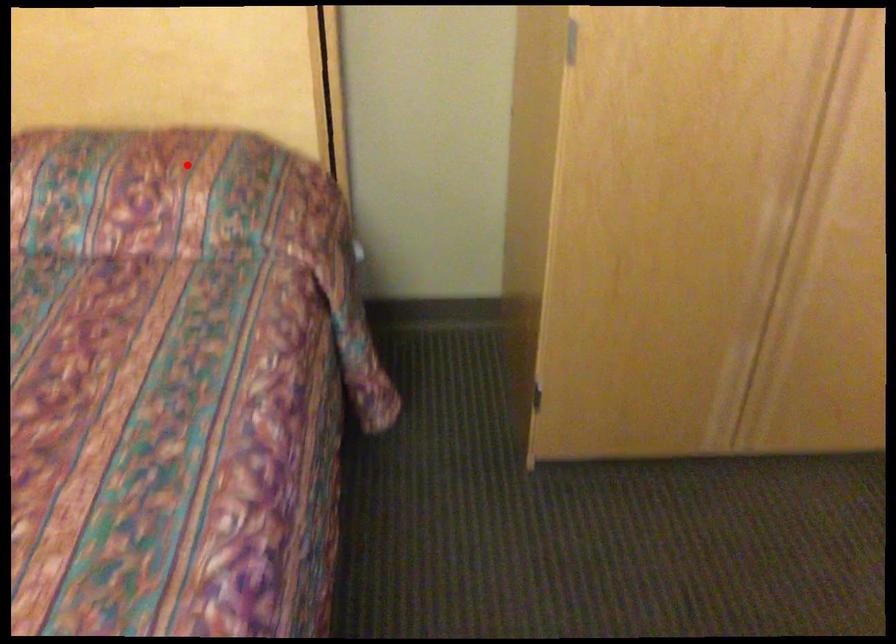
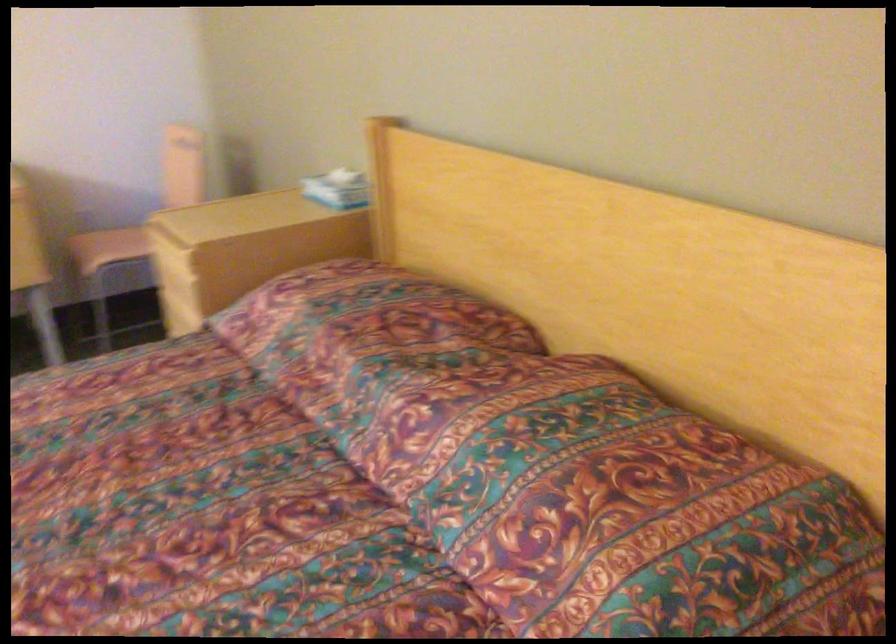
Locate, in the second image, the point that corresponds to the highlighted location in the first image.

(631, 512)